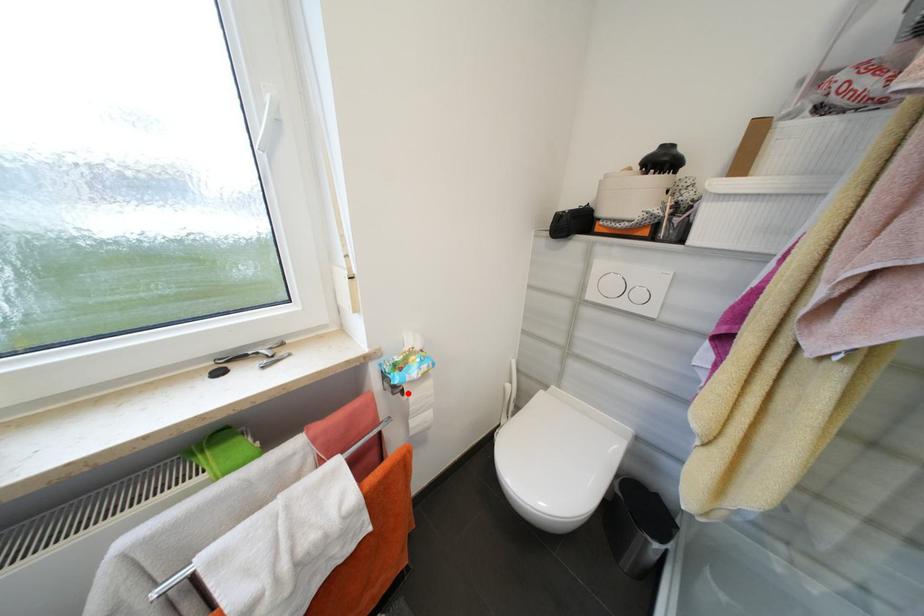
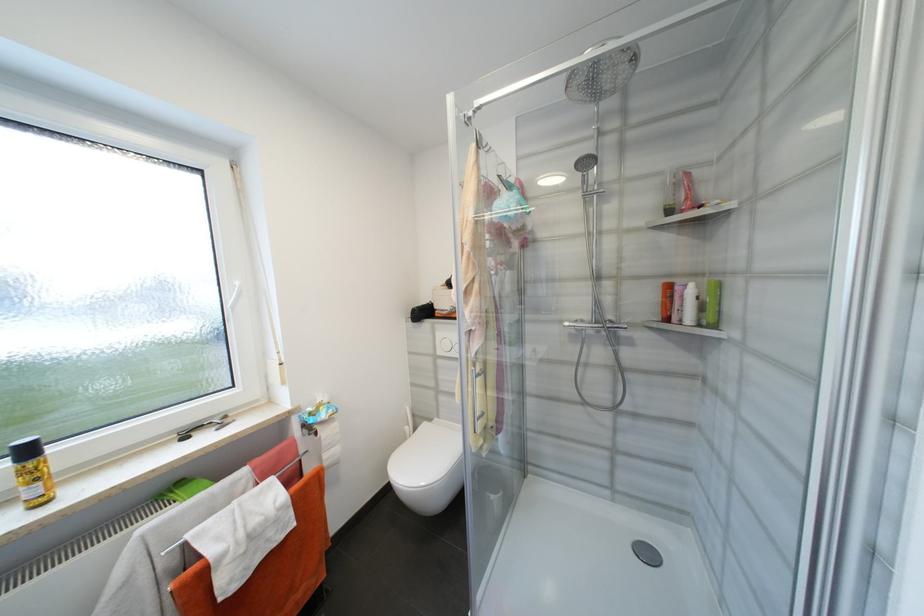
In the second image, find the point that corresponds to the highlighted location in the first image.

(322, 435)